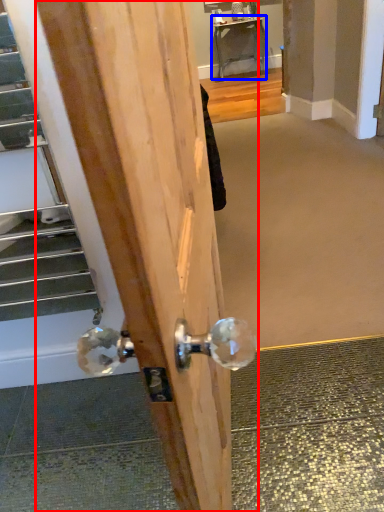
Question: Among these objects, which one is farthest to the camera, door (highlighted by a red box) or table (highlighted by a blue box)?

Choices:
 (A) door
 (B) table

Answer: (B)